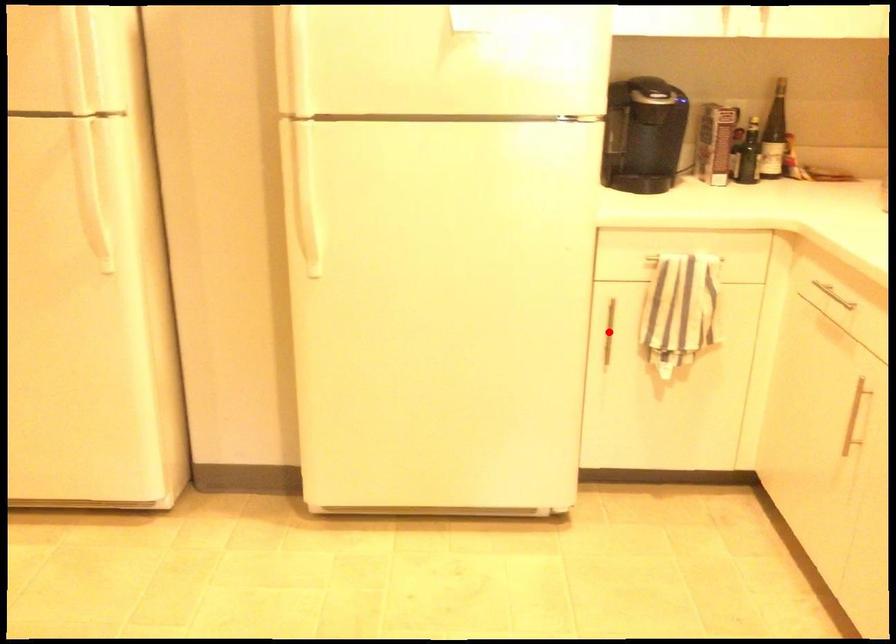
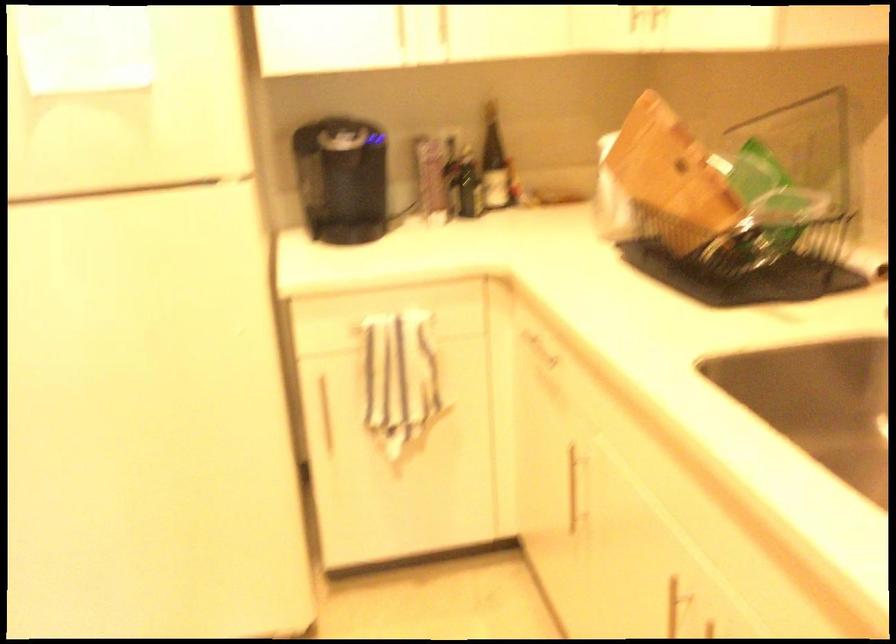
Question: I am providing you with two images of the same scene from different viewpoints. In image1, a red point is highlighted. Considering the same 3D point in image2, which of the following is correct?

Choices:
 (A) It is closer
 (B) It is farther

Answer: (A)